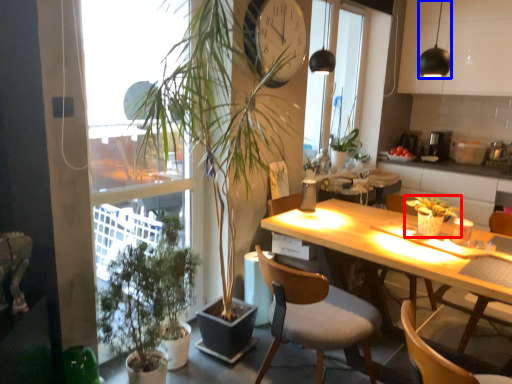
Question: Which object appears farthest to the camera in this image, houseplant (highlighted by a red box) or lamp (highlighted by a blue box)?

Choices:
 (A) houseplant
 (B) lamp

Answer: (A)